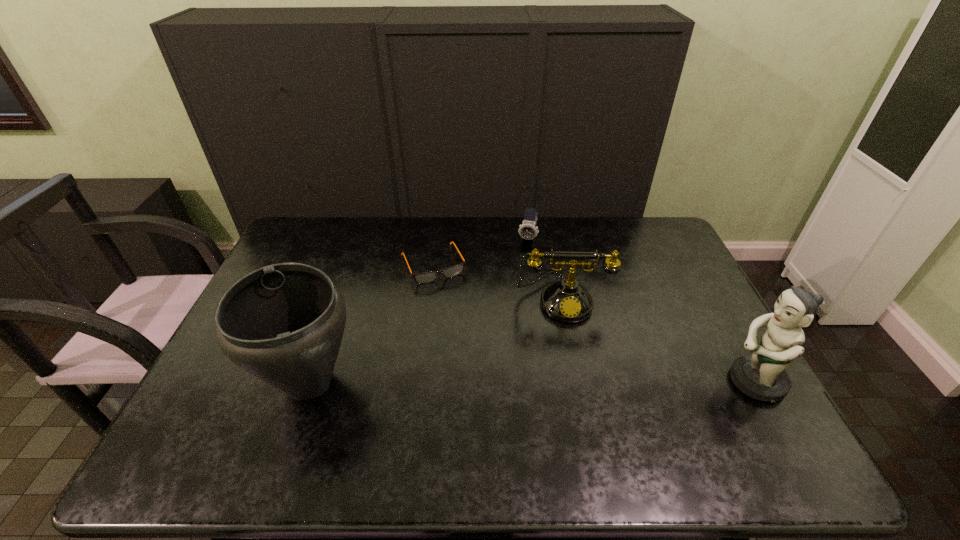
Where is `vacant spot on the desktop that is between the urn and the rightmost object and is positioned on the front-facing side of the shortest object`? This screenshot has width=960, height=540. vacant spot on the desktop that is between the urn and the rightmost object and is positioned on the front-facing side of the shortest object is located at coordinates (488, 382).

Where is `free space on the desktop that is between the leftmost object and the figurine and is positioned on the face of the fourth tallest object`? This screenshot has width=960, height=540. free space on the desktop that is between the leftmost object and the figurine and is positioned on the face of the fourth tallest object is located at coordinates (492, 382).

I want to click on free spot on the desktop that is between the leftmost object and the rightmost object and is positioned on the dial of the third shortest object, so click(575, 381).